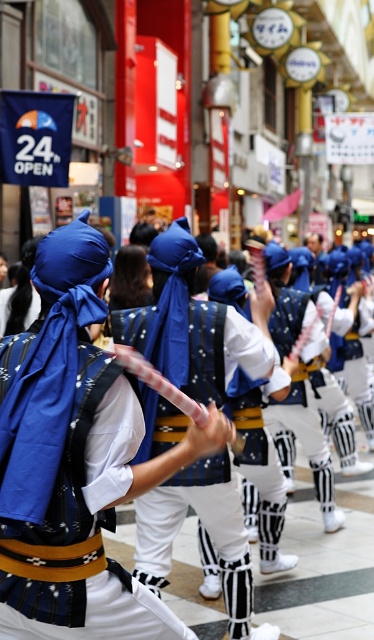
Based on the photo, you are a photographer trying to capture a clear shot of the performers. You notice the matte blue headscarf at center and the white matte uniform at center. Which object should you focus on first if you want to ensure both are in focus, considering their size in the frame?

The matte blue headscarf at center is not as tall as the white matte uniform at center, so you should focus on the white matte uniform at center first since it is larger and will require more precise focusing to ensure clarity.

You are a costume designer preparing for a traditional Japanese performance. You have two items at center stage, the matte blue headscarf at center and the blue fabric mask at center. Which item is larger?

The matte blue headscarf at center is bigger than the blue fabric mask at center.